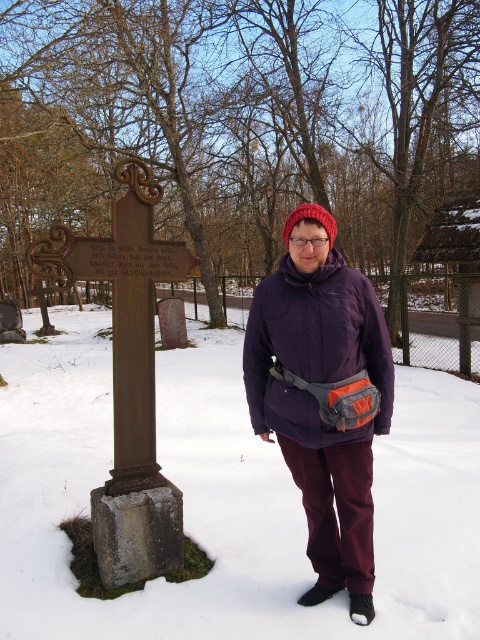
You are a photographer trying to capture both the purple fleece jacket at center and the bronze stone cross at left in a single shot. Based on their positions, which object will appear larger in the photo?

The purple fleece jacket at center appears larger in the photo because it is closer to the viewer than the bronze stone cross at left.

You are a photographer trying to capture a photo of the purple fleece jacket at center and the bronze stone cross at left. Which object should you focus on first if you want to ensure both are in focus without adjusting your camera settings?

The bronze stone cross at left should be focused on first because it is farther away from the photographer than the purple fleece jacket at center, so focusing on the farther object ensures both will be in focus.